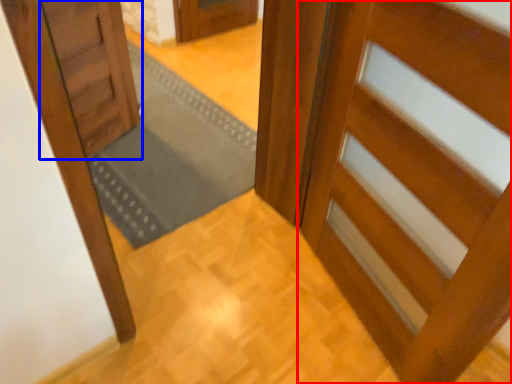
Question: Among these objects, which one is farthest to the camera, door (highlighted by a red box) or door (highlighted by a blue box)?

Choices:
 (A) door
 (B) door

Answer: (B)